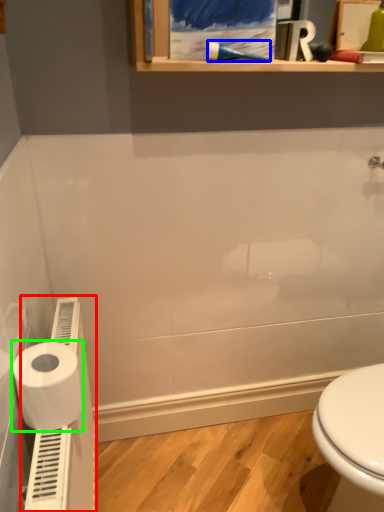
Question: Which is nearer to the water heater (highlighted by a red box)? shower (highlighted by a blue box) or toilet paper (highlighted by a green box).

Choices:
 (A) shower
 (B) toilet paper

Answer: (B)